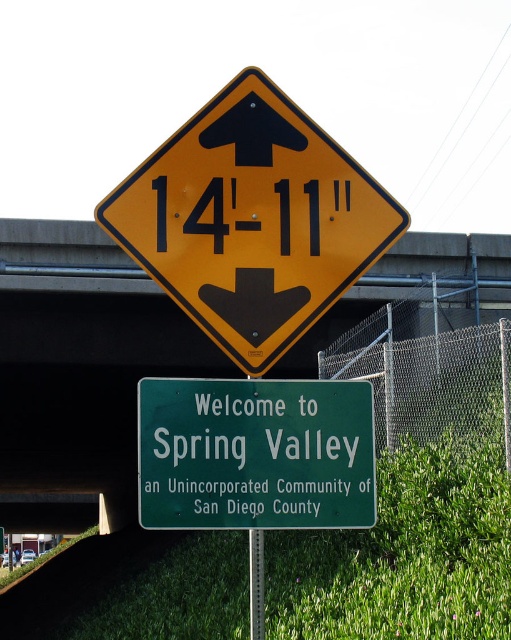
Between brushed metal overpass at upper center and green matte signboard at center, which one appears on the left side from the viewer's perspective?

Positioned to the left is brushed metal overpass at upper center.

Is brushed metal overpass at upper center taller than green matte signboard at center?

Indeed, brushed metal overpass at upper center has a greater height compared to green matte signboard at center.

Measure the distance between point (53, 225) and camera.

Point (53, 225) is 13.45 meters away from camera.

At what (x,y) coordinates should I click in order to perform the action: click on brushed metal overpass at upper center. Please return your answer as a coordinate pair (x, y). The width and height of the screenshot is (511, 640). Looking at the image, I should click on (79, 371).

Which of these two, chain link fence at center right or green metallic pole at lower center, stands taller?

With more height is chain link fence at center right.

Is chain link fence at center right shorter than green metallic pole at lower center?

No, chain link fence at center right is not shorter than green metallic pole at lower center.

Between point (400, 378) and point (250, 541), which one is positioned behind?

The point (400, 378) is more distant.

Image resolution: width=511 pixels, height=640 pixels. Identify the location of chain link fence at center right. (429, 378).

Describe the element at coordinates (251, 220) in the screenshot. I see `yellow matte diamond at upper center` at that location.

Is point (246, 154) positioned before point (430, 396)?

Yes, it is in front of point (430, 396).

The height and width of the screenshot is (640, 511). Identify the location of yellow matte diamond at upper center. (251, 220).

Find the location of `yellow matte diamond at upper center`. yellow matte diamond at upper center is located at coordinates (251, 220).